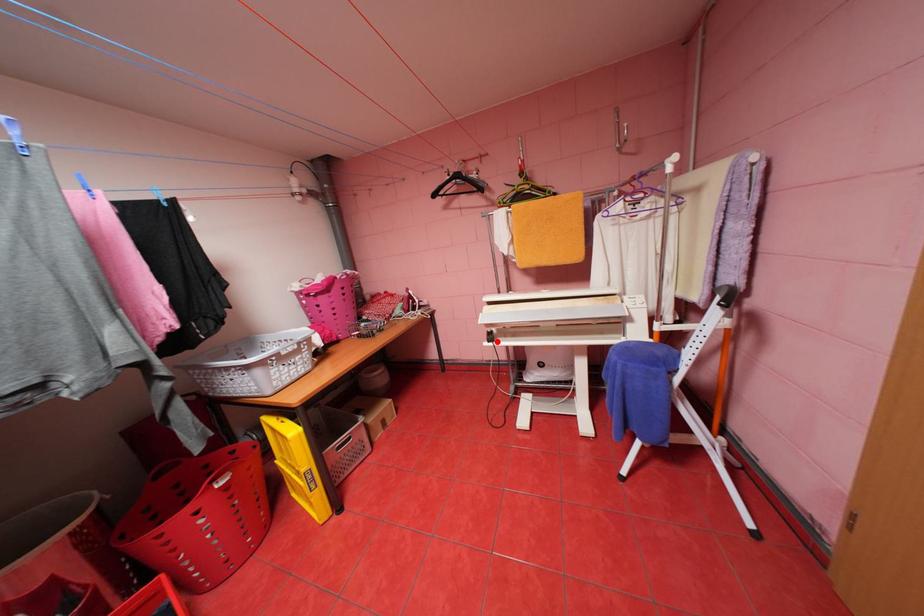
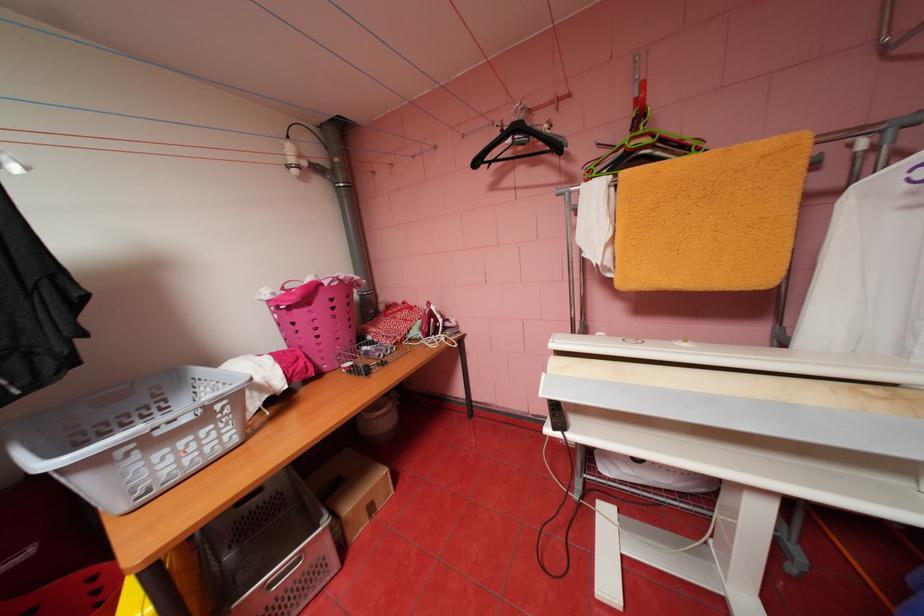
Where in the second image is the point corresponding to the highlighted location from the first image?

(563, 429)